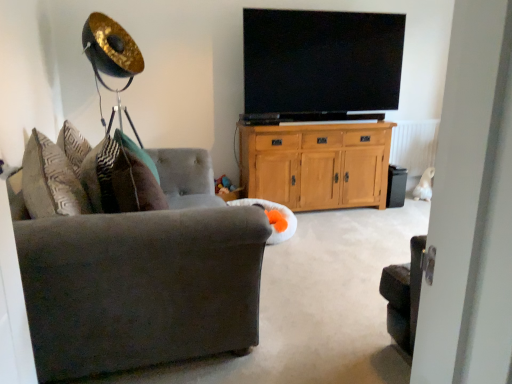
What do you see at coordinates (127, 177) in the screenshot?
I see `green fabric pillow at left` at bounding box center [127, 177].

The width and height of the screenshot is (512, 384). Describe the element at coordinates (396, 186) in the screenshot. I see `black matte speaker at lower right` at that location.

What do you see at coordinates (273, 218) in the screenshot? Image resolution: width=512 pixels, height=384 pixels. I see `white soft bean bag at center` at bounding box center [273, 218].

Identify the location of flat-screen tv at upper center. (320, 65).

This screenshot has width=512, height=384. I want to click on light oak cabinet at center, so click(316, 164).

The image size is (512, 384). What do you see at coordinates (316, 164) in the screenshot?
I see `light oak cabinet at center` at bounding box center [316, 164].

This screenshot has width=512, height=384. What are the coordinates of `green fabric pillow at left` in the screenshot? It's located at (127, 177).

Is flat-screen tv at upper center with green fabric pillow at left?

No.

Is point (339, 82) closer to camera compared to point (114, 204)?

No, it is not.

Is flat-screen tv at upper center facing away from green fabric pillow at left?

No, flat-screen tv at upper center's orientation is not away from green fabric pillow at left.

Which object is further away from the camera taking this photo, flat-screen tv at upper center or green fabric pillow at left?

Positioned behind is flat-screen tv at upper center.

Visually, is light oak cabinet at center positioned to the left or to the right of black matte speaker at lower right?

Based on their positions, light oak cabinet at center is located to the left of black matte speaker at lower right.

Could you tell me if light oak cabinet at center is turned towards black matte speaker at lower right?

No, light oak cabinet at center is not oriented towards black matte speaker at lower right.

From the image's perspective, which one is positioned higher, light oak cabinet at center or black matte speaker at lower right?

From the image's view, light oak cabinet at center is above.

From the image's perspective, which object appears higher, green fabric pillow at left or flat-screen tv at upper center?

flat-screen tv at upper center appears higher in the image.

Can you confirm if green fabric pillow at left is bigger than flat-screen tv at upper center?

No.

From a real-world perspective, is green fabric pillow at left positioned over flat-screen tv at upper center based on gravity?

No, from a real-world perspective, green fabric pillow at left is not on top of flat-screen tv at upper center.

How many degrees apart are the facing directions of green fabric pillow at left and flat-screen tv at upper center?

green fabric pillow at left and flat-screen tv at upper center are facing 80.7 degrees away from each other.

Visually, is velvet gray couch at left positioned to the left or to the right of flat-screen tv at upper center?

Based on their positions, velvet gray couch at left is located to the left of flat-screen tv at upper center.

Between velvet gray couch at left and flat-screen tv at upper center, which one has larger width?

With larger width is velvet gray couch at left.

Who is taller, velvet gray couch at left or flat-screen tv at upper center?

flat-screen tv at upper center.

Looking at this image, from a real-world perspective, which object rests below the other?

From a 3D spatial view, velvet gray couch at left is below.

Is light oak cabinet at center inside or outside of white soft bean bag at center?

light oak cabinet at center is not inside white soft bean bag at center, it's outside.

Does light oak cabinet at center touch white soft bean bag at center?

There is a gap between light oak cabinet at center and white soft bean bag at center.

Which object is further away from the camera, light oak cabinet at center or white soft bean bag at center?

light oak cabinet at center is more distant.

How much distance is there between light oak cabinet at center and white soft bean bag at center?

4.40 feet.

Is black matte speaker at lower right positioned behind green fabric pillow at left?

Yes, black matte speaker at lower right is further from the viewer.

Is black matte speaker at lower right facing away from green fabric pillow at left?

black matte speaker at lower right does not have its back to green fabric pillow at left.

Is black matte speaker at lower right taller than green fabric pillow at left?

No, black matte speaker at lower right is not taller than green fabric pillow at left.

Consider the image. Which object is more forward, velvet gray couch at left or green fabric pillow at left?

velvet gray couch at left is more forward.

Is point (78, 261) closer or farther from the camera than point (120, 194)?

Point (78, 261) is positioned closer to the camera compared to point (120, 194).

How much distance is there between velvet gray couch at left and green fabric pillow at left?

velvet gray couch at left is 26.88 centimeters away from green fabric pillow at left.

Could you tell me if velvet gray couch at left is turned towards green fabric pillow at left?

No, velvet gray couch at left does not turn towards green fabric pillow at left.

Where is `pillow below the flat-screen tv at upper center (from the image's perspective)`? pillow below the flat-screen tv at upper center (from the image's perspective) is located at coordinates (127, 177).

Find the location of `cabinetry in front of the black matte speaker at lower right`. cabinetry in front of the black matte speaker at lower right is located at coordinates tap(316, 164).

Based on their spatial positions, is light oak cabinet at center or velvet gray couch at left further from flat-screen tv at upper center?

velvet gray couch at left lies further to flat-screen tv at upper center than the other object.

Considering their positions, is white soft bean bag at center positioned further to green fabric pillow at left than light oak cabinet at center?

light oak cabinet at center.

Based on their spatial positions, is green fabric pillow at left or flat-screen tv at upper center closer to light oak cabinet at center?

flat-screen tv at upper center is positioned closer to the anchor light oak cabinet at center.

Looking at the image, which one is located closer to velvet gray couch at left, white soft bean bag at center or flat-screen tv at upper center?

white soft bean bag at center lies closer to velvet gray couch at left than the other object.

Considering their positions, is velvet gray couch at left positioned further to flat-screen tv at upper center than black matte speaker at lower right?

velvet gray couch at left is positioned further to the anchor flat-screen tv at upper center.

From the image, which object appears to be nearer to velvet gray couch at left, black matte speaker at lower right or light oak cabinet at center?

light oak cabinet at center lies closer to velvet gray couch at left than the other object.

Estimate the real-world distances between objects in this image. Which object is further from velvet gray couch at left, light oak cabinet at center or white soft bean bag at center?

light oak cabinet at center is further to velvet gray couch at left.

Considering their positions, is velvet gray couch at left positioned closer to black matte speaker at lower right than light oak cabinet at center?

The object closer to black matte speaker at lower right is light oak cabinet at center.

Locate an element on the screen. Image resolution: width=512 pixels, height=384 pixels. speaker between flat-screen tv at upper center and white soft bean bag at center vertically is located at coordinates (396, 186).

Identify the location of pillow between velvet gray couch at left and black matte speaker at lower right along the z-axis. The width and height of the screenshot is (512, 384). (127, 177).

Locate an element on the screen. pillow located between velvet gray couch at left and light oak cabinet at center in the depth direction is located at coordinates (127, 177).

The height and width of the screenshot is (384, 512). Identify the location of cabinetry located between white soft bean bag at center and black matte speaker at lower right in the left-right direction. pos(316,164).